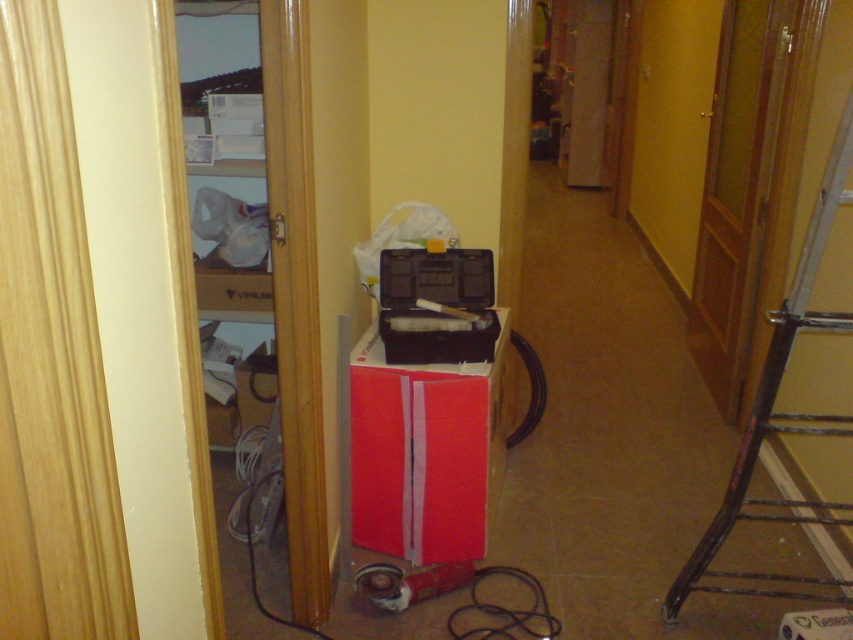
Question: Among these objects, which one is farthest from the camera?

Choices:
 (A) metallic black ladder at right
 (B) red cardboard box at center

Answer: (B)

Question: Which point is farther to the camera?

Choices:
 (A) metallic black ladder at right
 (B) red cardboard box at center

Answer: (B)

Question: Is red cardboard box at center to the left of metallic black ladder at right from the viewer's perspective?

Choices:
 (A) yes
 (B) no

Answer: (A)

Question: Can you confirm if red cardboard box at center is wider than metallic black ladder at right?

Choices:
 (A) yes
 (B) no

Answer: (B)

Question: Is red cardboard box at center thinner than metallic black ladder at right?

Choices:
 (A) no
 (B) yes

Answer: (B)